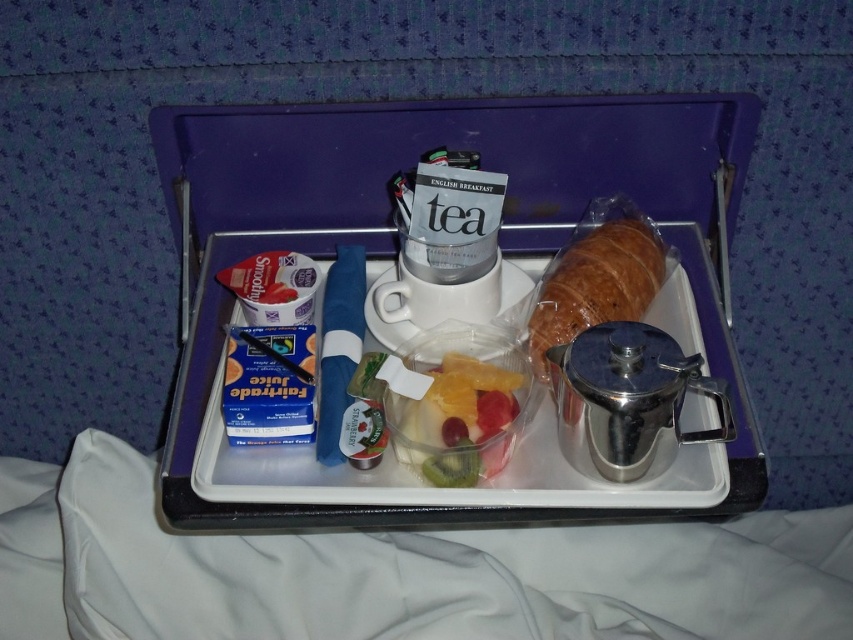
Question: Which point appears closest to the camera in this image?

Choices:
 (A) (537, 349)
 (B) (525, 252)
 (C) (407, 440)

Answer: (C)

Question: Is translucent plastic container of fruit salad at center bigger than golden brown croissant at right?

Choices:
 (A) no
 (B) yes

Answer: (A)

Question: Estimate the real-world distances between objects in this image. Which object is closer to the translucent plastic container of fruit salad at center?

Choices:
 (A) golden brown croissant at right
 (B) metallic silver tray at center

Answer: (A)

Question: Which of the following is the farthest from the observer?

Choices:
 (A) translucent plastic container of fruit salad at center
 (B) metallic silver tray at center

Answer: (A)

Question: Does metallic silver tray at center lie in front of translucent plastic container of fruit salad at center?

Choices:
 (A) yes
 (B) no

Answer: (A)

Question: Is metallic silver tray at center thinner than golden brown croissant at right?

Choices:
 (A) yes
 (B) no

Answer: (B)